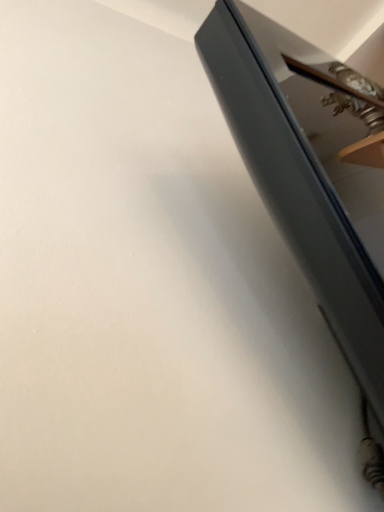
Describe the element at coordinates (311, 167) in the screenshot. I see `matte gray cabinet at upper right` at that location.

Locate an element on the screen. Image resolution: width=384 pixels, height=512 pixels. matte gray cabinet at upper right is located at coordinates (311, 167).

Find the location of `matte gray cabinet at upper right`. matte gray cabinet at upper right is located at coordinates coord(311,167).